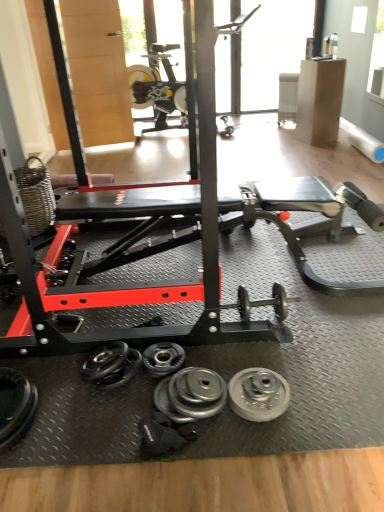
Find the location of a particular element. free spot to the left of silver metallic dumbbell at center, the second dumbbell when ordered from left to right is located at coordinates (113, 388).